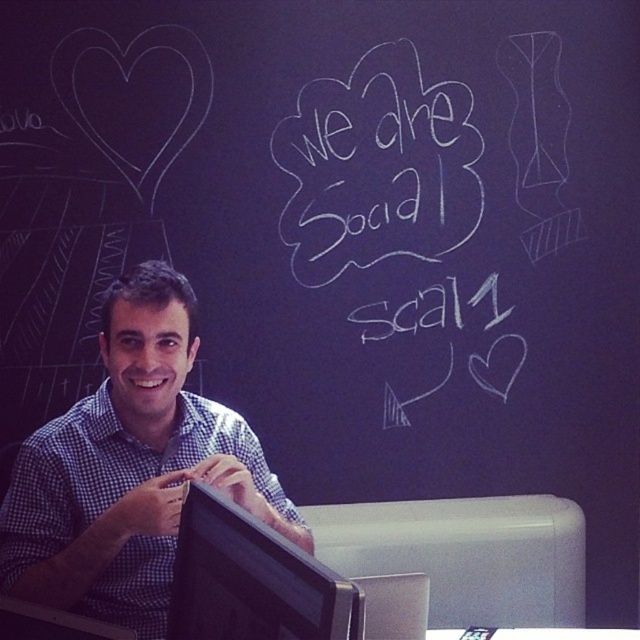
Question: Among these points, which one is nearest to the camera?

Choices:
 (A) (131, 561)
 (B) (253, 573)
 (C) (285, 140)

Answer: (B)

Question: Considering the real-world distances, which object is farthest from the black glossy monitor at center?

Choices:
 (A) white chalk writing at upper center
 (B) checkered fabric shirt at left

Answer: (A)

Question: Does white chalk writing at upper center have a smaller size compared to black glossy monitor at center?

Choices:
 (A) yes
 (B) no

Answer: (B)

Question: Is white chalk writing at upper center smaller than black glossy monitor at center?

Choices:
 (A) no
 (B) yes

Answer: (A)

Question: Does white chalk writing at upper center appear on the right side of black glossy monitor at center?

Choices:
 (A) no
 (B) yes

Answer: (B)

Question: Among these objects, which one is nearest to the camera?

Choices:
 (A) white chalk writing at upper center
 (B) checkered fabric shirt at left
 (C) black glossy monitor at center

Answer: (C)